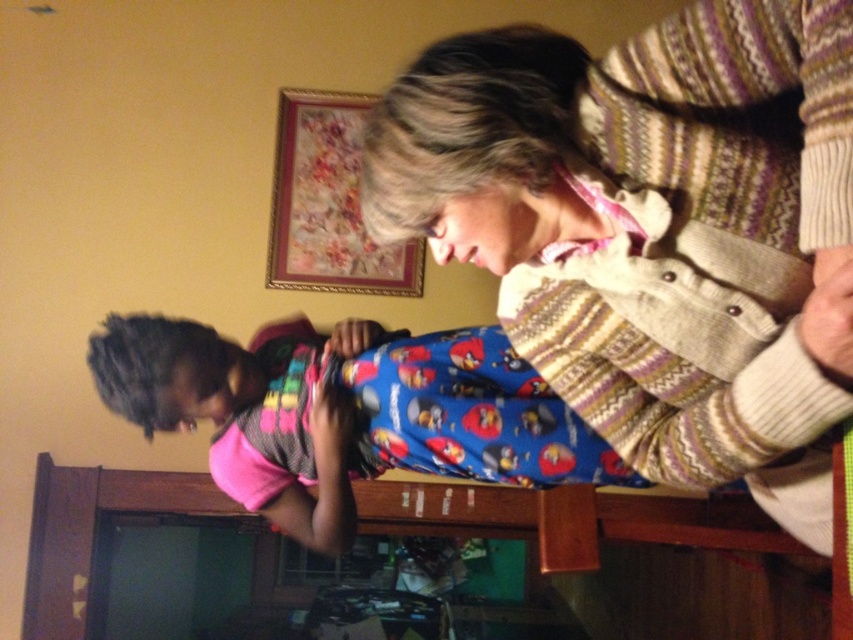
Question: Can you confirm if striped knit sweater at upper right is smaller than blue cotton pajama at center?

Choices:
 (A) yes
 (B) no

Answer: (B)

Question: Which point is closer to the camera?

Choices:
 (A) striped knit sweater at upper right
 (B) blue cotton pajama at center

Answer: (A)

Question: Does striped knit sweater at upper right have a larger size compared to blue cotton pajama at center?

Choices:
 (A) no
 (B) yes

Answer: (B)

Question: Can you confirm if striped knit sweater at upper right is bigger than blue cotton pajama at center?

Choices:
 (A) yes
 (B) no

Answer: (A)

Question: Among these objects, which one is farthest from the camera?

Choices:
 (A) striped knit sweater at upper right
 (B) blue cotton pajama at center

Answer: (B)

Question: Among these points, which one is farthest from the camera?

Choices:
 (A) coord(316,400)
 (B) coord(732,35)

Answer: (A)